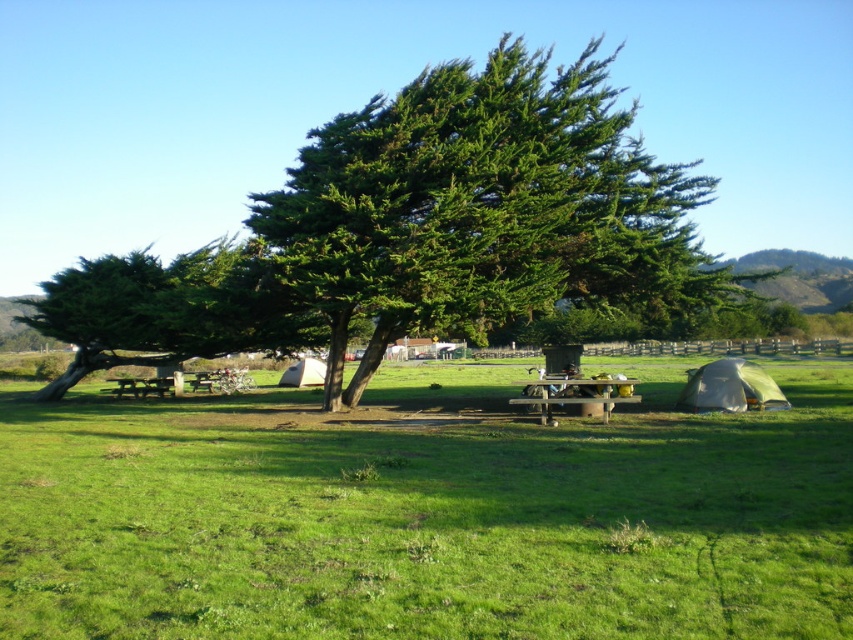
You are standing at the point labeled point (428,513). What do you see directly beneath your feet?

The point (428,513) indicates green grassy field at center, so you are standing on the green grassy field at center.

You are planning to set up a new tent in this camping area. You notice the green fabric tent at lower right and the white canvas tent at center. Which tent has a lower height?

The green fabric tent at lower right is shorter than the white canvas tent at center, so the green fabric tent at lower right has a lower height.